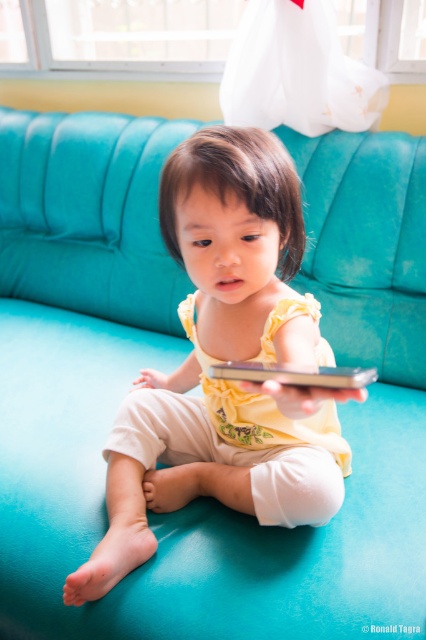
Does point (80, 595) come behind point (299, 369)?

Yes, it is behind point (299, 369).

Locate an element on the screen. yellow fabric child at center is located at coordinates (226, 358).